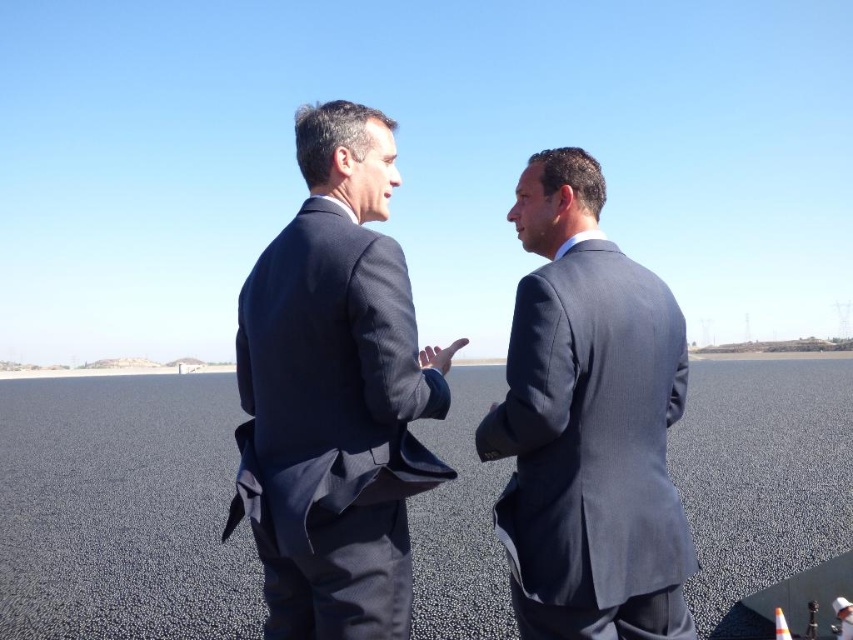
Locate an element on the screen. This screenshot has height=640, width=853. black asphalt tarmac at center is located at coordinates (122, 509).

Which is behind, point (833, 548) or point (646, 301)?

Positioned behind is point (833, 548).

Where is `black asphalt tarmac at center`? black asphalt tarmac at center is located at coordinates (122, 509).

Can you confirm if dark blue suit at center is smaller than matte gray suit at center?

Incorrect, dark blue suit at center is not smaller in size than matte gray suit at center.

Can you confirm if dark blue suit at center is positioned below matte gray suit at center?

No, dark blue suit at center is not below matte gray suit at center.

Does point (289, 524) come closer to viewer compared to point (561, 160)?

Yes, point (289, 524) is in front of point (561, 160).

Identify the location of dark blue suit at center. (334, 394).

Is black asphalt tarmac at center bigger than dark blue suit at center?

Indeed, black asphalt tarmac at center has a larger size compared to dark blue suit at center.

Does point (836, 442) come farther from viewer compared to point (415, 490)?

Yes, it is.

This screenshot has height=640, width=853. Find the location of `black asphalt tarmac at center`. black asphalt tarmac at center is located at coordinates (122, 509).